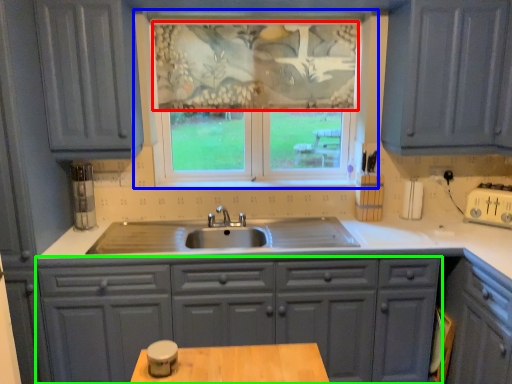
Question: Based on their relative distances, which object is nearer to curtain (highlighted by a red box)? Choose from window (highlighted by a blue box) and cabinetry (highlighted by a green box).

Choices:
 (A) window
 (B) cabinetry

Answer: (A)